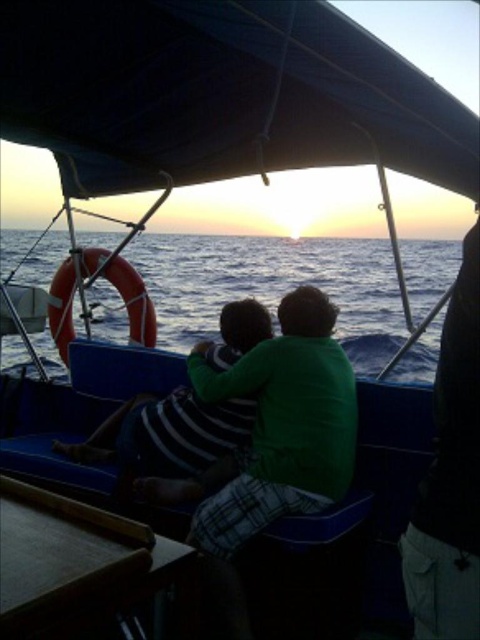
You are a photographer standing on the boat deck. You want to take a photo of the blue water at center and the green cotton shirt at center in the same frame. Given that your camera has a maximum focus range of 4 meters, will you be able to capture both subjects clearly in one shot?

The blue water at center and green cotton shirt at center are 4.42 meters apart. Since the distance between them exceeds the camera maximum focus range of 4 meters, you won understand if both can be in focus simultaneously. However, depending on the depth of field, it might be possible to have both in acceptable focus if the aperture is set appropriately. Alternatively, you could try moving closer to reduce the distance between the subjects in the frame.

You are a photographer on the boat trying to capture a group photo of the two people wearing green shirts. The camera you have can only focus on subjects within a 3 feet range. Can you take a photo of both the green cotton shirt at center and the green fabric shirt at right without moving the camera?

The green cotton shirt at center and green fabric shirt at right are 3.40 feet apart from each other. Since the camera can only focus within 3 feet, the distance between them exceeds the focus range. Therefore, you cannot capture both in focus without moving the camera.

You are standing at point (280, 304) on the boat and want to reach the edge of the boat which is 2 meters away from you. Can you safely walk straight to the edge without falling?

The distance between you and the edge of the boat is 2 meters, so yes, you can safely walk straight to the edge without falling as it is within a safe distance.